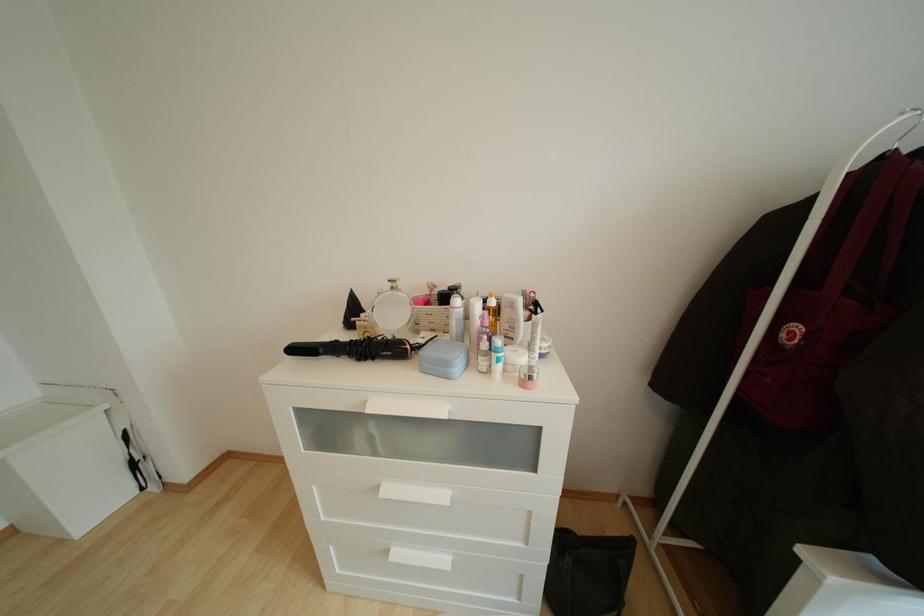
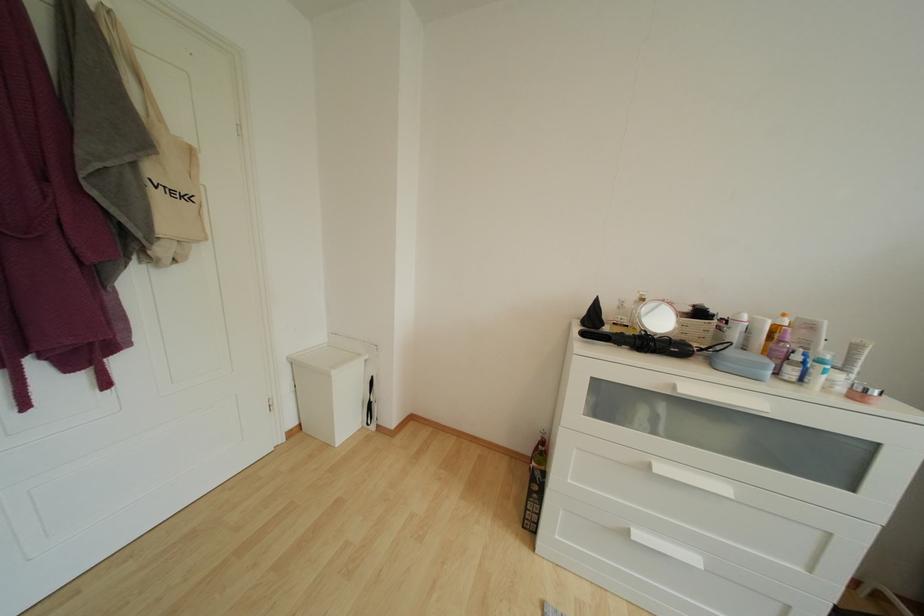
Where in the second image is the point corresponding to pixel 497 306 from the first image?

(789, 326)